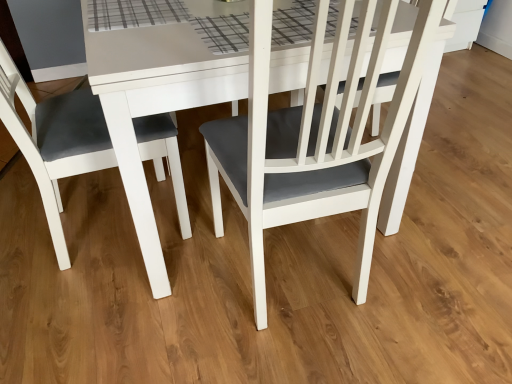
Question: Does matte white chair at center, acting as the first chair starting from the right, turn towards matte white chair at left, which ranks as the second chair in right-to-left order?

Choices:
 (A) yes
 (B) no

Answer: (B)

Question: Are matte white chair at center, the 2th chair from the left, and matte white chair at left, which ranks as the second chair in right-to-left order, far apart?

Choices:
 (A) no
 (B) yes

Answer: (A)

Question: Would you say matte white chair at left, which ranks as the second chair in right-to-left order, is part of matte white chair at center, the 2th chair from the left,'s contents?

Choices:
 (A) yes
 (B) no

Answer: (B)

Question: From a real-world perspective, is matte white chair at center, the 2th chair from the left, positioned under matte white chair at left, which ranks as the second chair in right-to-left order, based on gravity?

Choices:
 (A) yes
 (B) no

Answer: (A)

Question: Is matte white chair at center, acting as the first chair starting from the right, bigger than matte white chair at left, which ranks as the second chair in right-to-left order?

Choices:
 (A) no
 (B) yes

Answer: (B)

Question: Considering the relative sizes of matte white chair at center, acting as the first chair starting from the right, and matte white chair at left, which ranks as the second chair in right-to-left order, in the image provided, is matte white chair at center, acting as the first chair starting from the right, wider than matte white chair at left, which ranks as the second chair in right-to-left order,?

Choices:
 (A) yes
 (B) no

Answer: (A)

Question: Considering the relative positions of matte white chair at left, the first chair positioned from the left, and matte white chair at center, acting as the first chair starting from the right, in the image provided, is matte white chair at left, the first chair positioned from the left, in front of matte white chair at center, acting as the first chair starting from the right,?

Choices:
 (A) yes
 (B) no

Answer: (A)

Question: Can you confirm if matte white chair at left, the first chair positioned from the left, is taller than matte white chair at center, the 2th chair from the left?

Choices:
 (A) no
 (B) yes

Answer: (B)

Question: Is matte white chair at left, the first chair positioned from the left, placed right next to matte white chair at center, the 2th chair from the left?

Choices:
 (A) no
 (B) yes

Answer: (A)

Question: Is matte white chair at left, the first chair positioned from the left, at the right side of matte white chair at center, the 2th chair from the left?

Choices:
 (A) no
 (B) yes

Answer: (A)

Question: Can you confirm if matte white chair at left, the first chair positioned from the left, is thinner than matte white chair at center, acting as the first chair starting from the right?

Choices:
 (A) yes
 (B) no

Answer: (A)

Question: Is matte white chair at left, which ranks as the second chair in right-to-left order, further to camera compared to matte white chair at center, acting as the first chair starting from the right?

Choices:
 (A) no
 (B) yes

Answer: (A)

Question: Is matte white chair at left, which ranks as the second chair in right-to-left order, in front of or behind matte white chair at center, acting as the first chair starting from the right, in the image?

Choices:
 (A) behind
 (B) front

Answer: (B)